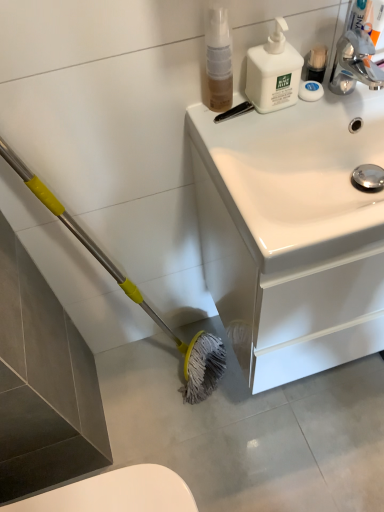
Question: Should I look upward or downward to see white glossy sink at upper right?

Choices:
 (A) up
 (B) down

Answer: (A)

Question: Does white matte soap at upper right have a greater width compared to white matte pump bottle at upper right, the second cleaning product in the left-to-right sequence?

Choices:
 (A) yes
 (B) no

Answer: (B)

Question: Is white matte soap at upper right oriented towards white matte pump bottle at upper right, the second cleaning product in the left-to-right sequence?

Choices:
 (A) yes
 (B) no

Answer: (B)

Question: Does white matte soap at upper right have a larger size compared to white matte pump bottle at upper right, which appears as the 1th cleaning product when viewed from the right?

Choices:
 (A) no
 (B) yes

Answer: (A)

Question: Is white matte pump bottle at upper right, which appears as the 1th cleaning product when viewed from the right, surrounded by white matte soap at upper right?

Choices:
 (A) yes
 (B) no

Answer: (B)

Question: Considering the relative positions of white matte soap at upper right and white matte pump bottle at upper right, the second cleaning product in the left-to-right sequence, in the image provided, is white matte soap at upper right to the left of white matte pump bottle at upper right, the second cleaning product in the left-to-right sequence, from the viewer's perspective?

Choices:
 (A) yes
 (B) no

Answer: (B)

Question: Can you confirm if white matte soap at upper right is thinner than white matte pump bottle at upper right, the second cleaning product in the left-to-right sequence?

Choices:
 (A) no
 (B) yes

Answer: (B)

Question: Is white glossy sink at upper right next to white matte soap at upper right and touching it?

Choices:
 (A) yes
 (B) no

Answer: (B)

Question: Can you confirm if white glossy sink at upper right is smaller than white matte soap at upper right?

Choices:
 (A) no
 (B) yes

Answer: (A)

Question: Does white glossy sink at upper right come behind white matte soap at upper right?

Choices:
 (A) no
 (B) yes

Answer: (A)

Question: From the image's perspective, is white glossy sink at upper right under white matte soap at upper right?

Choices:
 (A) yes
 (B) no

Answer: (A)

Question: Is white glossy sink at upper right taller than white matte soap at upper right?

Choices:
 (A) no
 (B) yes

Answer: (B)

Question: From the image's perspective, is white glossy sink at upper right above white matte soap at upper right?

Choices:
 (A) no
 (B) yes

Answer: (A)

Question: Does translucent plastic spray bottle at upper center, marked as the 1th cleaning product in a left-to-right arrangement, have a lesser width compared to white matte pump bottle at upper right, the second cleaning product in the left-to-right sequence?

Choices:
 (A) yes
 (B) no

Answer: (A)